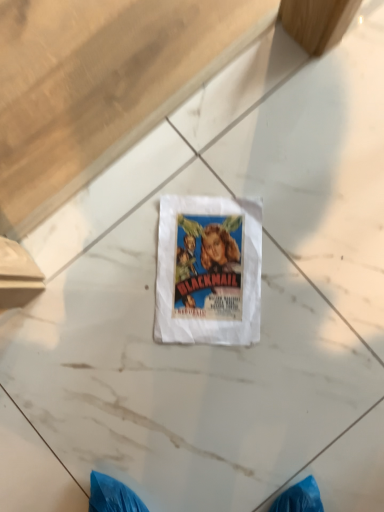
Where is `vacant space underneath colorful paper poster at center (from a real-world perspective)`? This screenshot has height=512, width=384. vacant space underneath colorful paper poster at center (from a real-world perspective) is located at coordinates (213, 266).